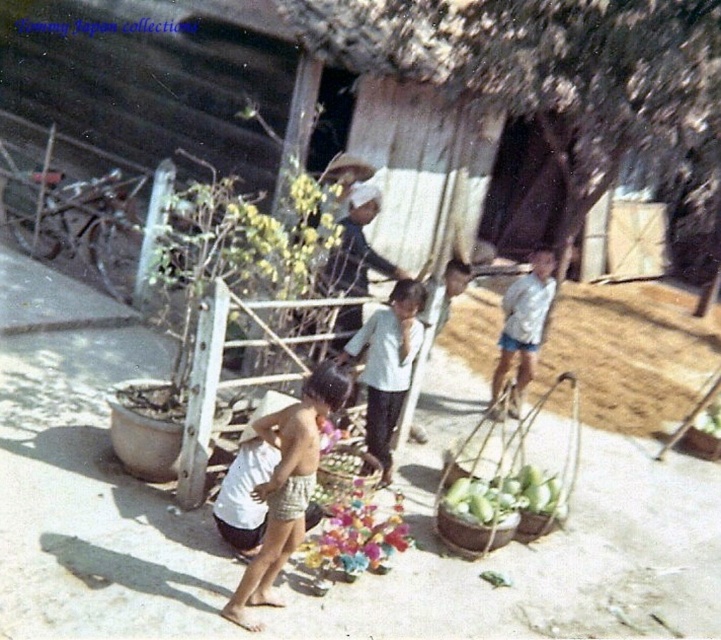
Question: Which of the following is the farthest from the observer?

Choices:
 (A) (349, 456)
 (B) (270, 476)
 (C) (373, 406)
 (D) (517, 394)

Answer: (D)

Question: In this image, where is brown woven basket at lower right located relative to multicolored woven basket at center?

Choices:
 (A) above
 (B) below

Answer: (A)

Question: Is brown woven basket at lower right to the left of multicolored woven basket at center from the viewer's perspective?

Choices:
 (A) no
 (B) yes

Answer: (A)

Question: Which point is closer to the camera?

Choices:
 (A) light brown shorts at center
 (B) white cotton shirt at right
 (C) white cotton shirt at center

Answer: (A)

Question: Does dark blue shirt at center appear under green matte leafy vegetables at lower center?

Choices:
 (A) no
 (B) yes

Answer: (A)

Question: Which point is closer to the camera?

Choices:
 (A) multicolored woven basket at center
 (B) green matte leafy vegetables at lower center

Answer: (A)